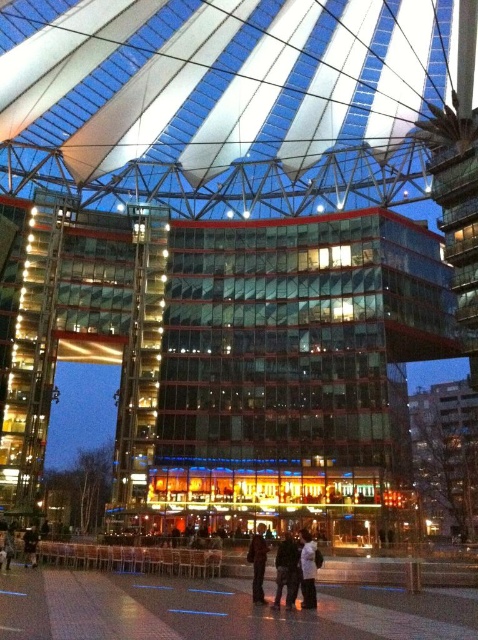
Question: Among these objects, which one is nearest to the camera?

Choices:
 (A) transparent fabric canopy at center
 (B) white matte jacket at center
 (C) dark blue jeans at lower left

Answer: (B)

Question: From the image, what is the correct spatial relationship of dark gray pants at center in relation to white matte jacket at center?

Choices:
 (A) left
 (B) right

Answer: (A)

Question: Which point is farther to the camera?

Choices:
 (A) (264, 547)
 (B) (304, 563)
 (C) (291, 586)

Answer: (A)

Question: Does transparent fabric canopy at center appear under dark blue jeans at lower left?

Choices:
 (A) no
 (B) yes

Answer: (A)

Question: Estimate the real-world distances between objects in this image. Which object is closer to the dark blue jeans at lower left?

Choices:
 (A) white matte jacket at center
 (B) transparent fabric canopy at center

Answer: (A)

Question: Observing the image, what is the correct spatial positioning of transparent fabric canopy at center in reference to dark blue jeans at lower left?

Choices:
 (A) above
 (B) below

Answer: (A)